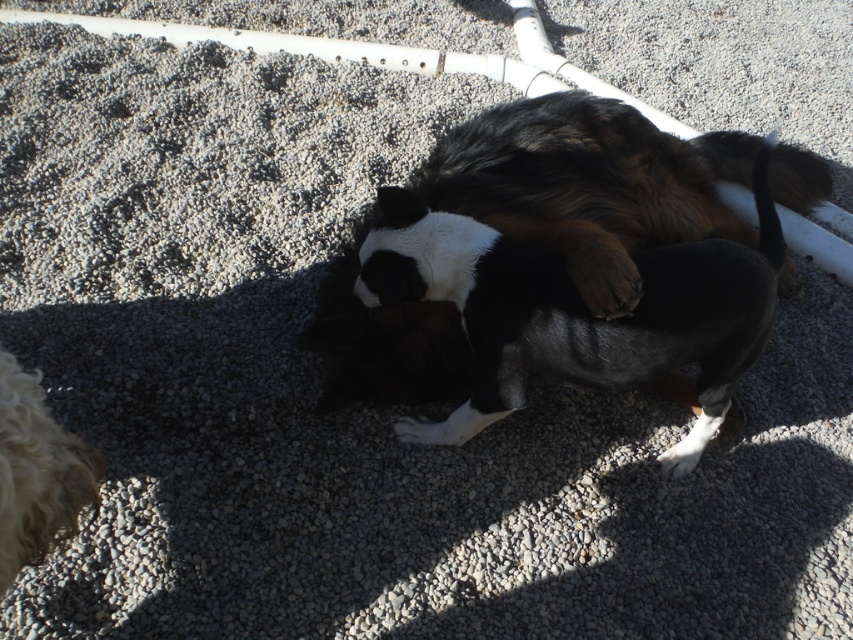
Question: Estimate the real-world distances between objects in this image. Which object is closer to the black and white fur at center?

Choices:
 (A) brown fur dog at center
 (B) white fur at center
 (C) brown furry paw at center
 (D) white fur paw at lower center

Answer: (C)

Question: Is white fur at center closer to camera compared to white fur paw at lower center?

Choices:
 (A) yes
 (B) no

Answer: (A)

Question: Is curly golden fur at lower left below brown furry paw at center?

Choices:
 (A) yes
 (B) no

Answer: (A)

Question: Which is nearer to the curly golden fur at lower left?

Choices:
 (A) brown furry paw at center
 (B) white fur paw at lower center
 (C) white fur at center

Answer: (C)

Question: Can you confirm if curly golden fur at lower left is positioned to the right of white fur paw at lower center?

Choices:
 (A) yes
 (B) no

Answer: (B)

Question: Which point is closer to the camera taking this photo?

Choices:
 (A) (589, 296)
 (B) (688, 433)

Answer: (A)